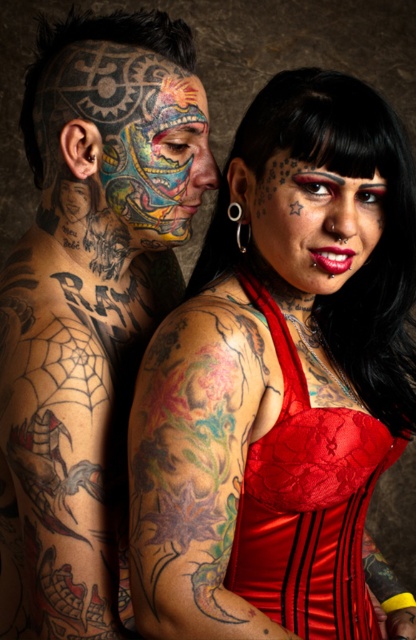
Question: Estimate the real-world distances between objects in this image. Which object is farther from the colorful tattooed face at center?

Choices:
 (A) red satin dress at center
 (B) matte red lace dress at center
 (C) multicolored tattooed face at center
 (D) shiny red lipstick at center

Answer: (A)

Question: Is multicolored tattooed face at center thinner than colorful tattooed face at center?

Choices:
 (A) no
 (B) yes

Answer: (A)

Question: Among these objects, which one is nearest to the camera?

Choices:
 (A) colorful tattooed face at center
 (B) shiny red lipstick at center

Answer: (A)

Question: In this image, where is multicolored tattooed face at center located relative to colorful tattooed face at center?

Choices:
 (A) below
 (B) above

Answer: (A)

Question: Which point is farther from the camera taking this photo?

Choices:
 (A) (176, 166)
 (B) (297, 417)
 (C) (376, 240)
 (D) (12, 445)

Answer: (C)

Question: Is red satin dress at center positioned in front of colorful tattooed face at center?

Choices:
 (A) no
 (B) yes

Answer: (A)